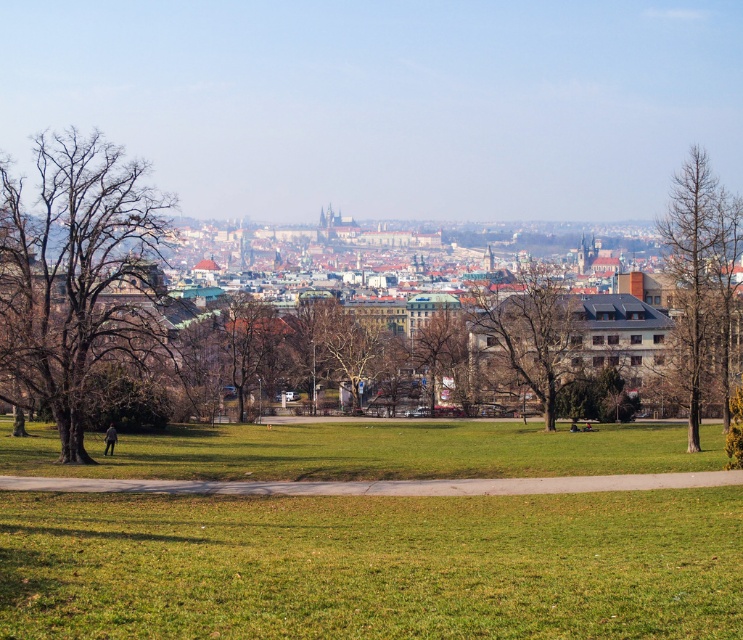
Question: Which of the following is the closest to the observer?

Choices:
 (A) (452, 305)
 (B) (507, 346)

Answer: (B)

Question: Can you confirm if green grass at center is thinner than brown textured tree at center?

Choices:
 (A) no
 (B) yes

Answer: (A)

Question: Is brown/dry wood tree at right thinner than brown textured tree at center?

Choices:
 (A) yes
 (B) no

Answer: (A)

Question: Does bare wood tree at left have a greater width compared to brown/dry wood tree at right?

Choices:
 (A) yes
 (B) no

Answer: (A)

Question: Which of the following is the closest to the observer?

Choices:
 (A) (412, 339)
 (B) (678, 189)

Answer: (B)

Question: Which point is farther to the camera?

Choices:
 (A) green grass at center
 (B) brown leafless tree at center
 (C) brown/dry wood tree at right

Answer: (B)